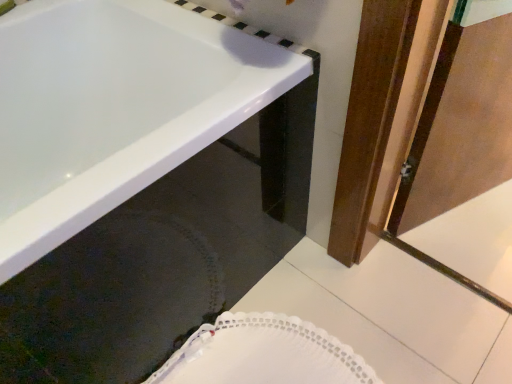
Describe the element at coordinates (114, 107) in the screenshot. The width and height of the screenshot is (512, 384). I see `white glossy bathtub at lower left` at that location.

The height and width of the screenshot is (384, 512). What are the coordinates of `white glossy bathtub at lower left` in the screenshot? It's located at (114, 107).

Measure the distance between point (x=134, y=121) and camera.

1.15 meters.

Find the location of a particular element. This screenshot has height=384, width=512. white glossy bathtub at lower left is located at coordinates (114, 107).